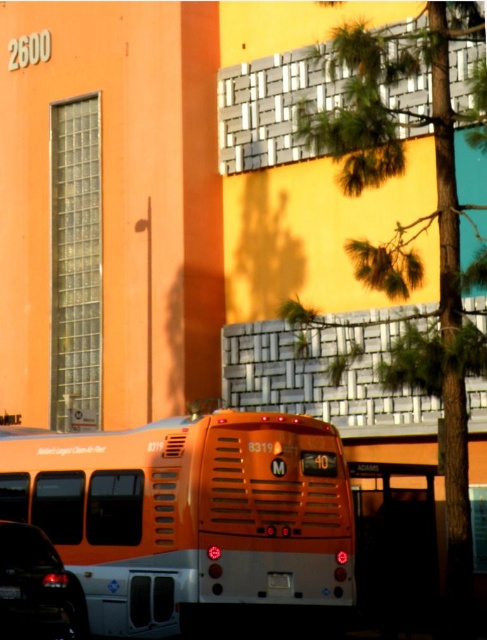
Question: Does orange matte bus at center appear over shiny black sedan at lower left?

Choices:
 (A) no
 (B) yes

Answer: (B)

Question: Which point is closer to the camera?

Choices:
 (A) (328, 524)
 (B) (44, 564)

Answer: (B)

Question: Is orange matte bus at center to the left of shiny black sedan at lower left from the viewer's perspective?

Choices:
 (A) yes
 (B) no

Answer: (B)

Question: Is orange matte bus at center wider than shiny black sedan at lower left?

Choices:
 (A) yes
 (B) no

Answer: (A)

Question: Which point is closer to the camera taking this photo?

Choices:
 (A) (13, 532)
 (B) (206, 420)

Answer: (A)